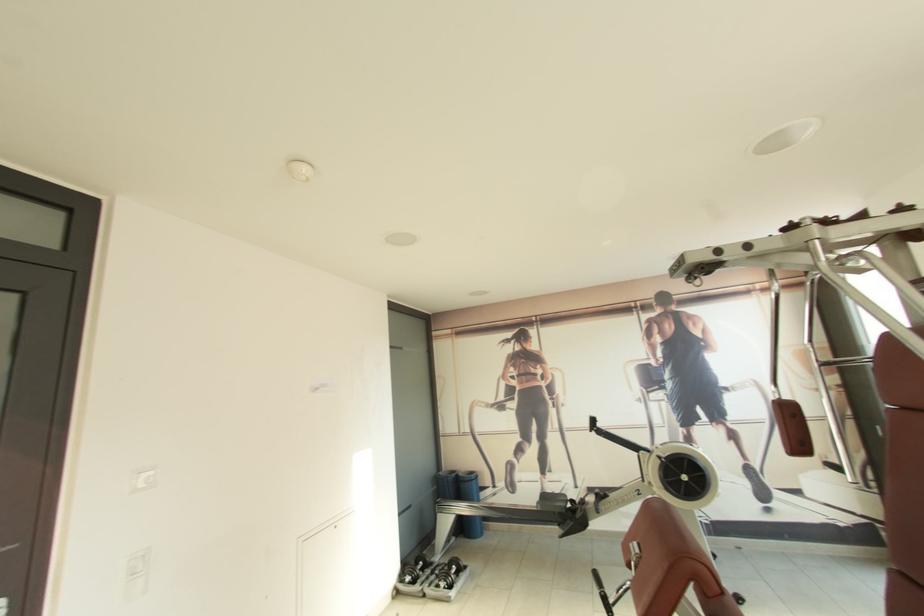
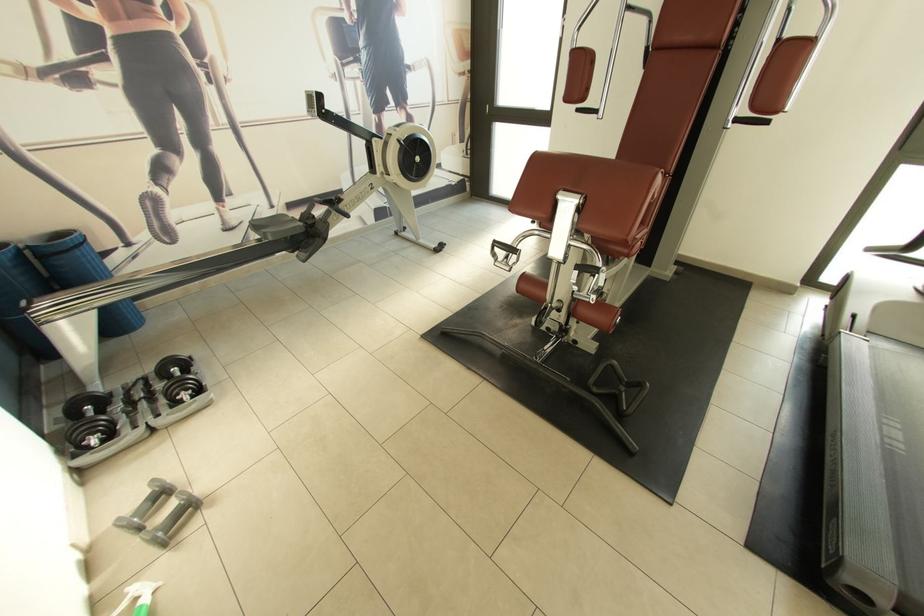
In the second image, find the point that corresponds to [427,570] in the first image.

(106, 413)